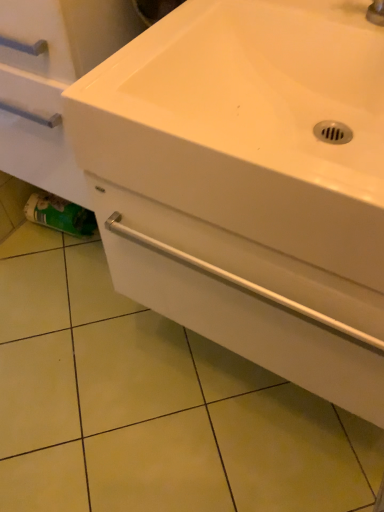
The height and width of the screenshot is (512, 384). Find the location of `white glossy drawer at center`. white glossy drawer at center is located at coordinates (247, 298).

Identify the location of white glossy sink at center. This screenshot has height=512, width=384. (249, 125).

From the picture: Is white glossy sink at center oriented away from white glossy drawer at center?

white glossy sink at center is not turned away from white glossy drawer at center.

From a real-world perspective, is white glossy sink at center on top of white glossy drawer at center?

Yes, from a real-world perspective, white glossy sink at center is above white glossy drawer at center.

Can you confirm if white glossy sink at center is bigger than white glossy drawer at center?

No.

Between point (130, 165) and point (341, 367), which one is positioned behind?

The point (341, 367) is behind.

Measure the distance from green matte toilet paper at lower left to white glossy drawer at center.

91.93 centimeters.

Is point (27, 202) behind point (132, 196)?

Yes, point (27, 202) is behind point (132, 196).

Which is correct: green matte toilet paper at lower left is inside white glossy drawer at center, or outside of it?

green matte toilet paper at lower left is spatially situated outside white glossy drawer at center.

Does point (218, 202) come in front of point (47, 206)?

Yes, it is in front of point (47, 206).

Could you tell me if white glossy sink at center is facing green matte toilet paper at lower left?

No, white glossy sink at center is not turned towards green matte toilet paper at lower left.

From a real-world perspective, is white glossy sink at center physically below green matte toilet paper at lower left?

No.

Does white glossy sink at center have a greater width compared to green matte toilet paper at lower left?

Indeed, white glossy sink at center has a greater width compared to green matte toilet paper at lower left.

Considering the positions of objects white glossy drawer at center and green matte toilet paper at lower left in the image provided, who is more to the right, white glossy drawer at center or green matte toilet paper at lower left?

From the viewer's perspective, white glossy drawer at center appears more on the right side.

Would you say white glossy drawer at center contains green matte toilet paper at lower left?

No, green matte toilet paper at lower left is not surrounded by white glossy drawer at center.

Can you confirm if white glossy drawer at center is thinner than green matte toilet paper at lower left?

Incorrect, the width of white glossy drawer at center is not less than that of green matte toilet paper at lower left.

Considering the sizes of objects white glossy drawer at center and green matte toilet paper at lower left in the image provided, who is smaller, white glossy drawer at center or green matte toilet paper at lower left?

green matte toilet paper at lower left is smaller.

Which of these two, white glossy drawer at center or white glossy sink at center, stands taller?

white glossy drawer at center.

Measure the distance from white glossy drawer at center to white glossy sink at center.

white glossy drawer at center and white glossy sink at center are 18.31 centimeters apart from each other.

Considering the positions of objects white glossy drawer at center and white glossy sink at center in the image provided, who is more to the left, white glossy drawer at center or white glossy sink at center?

From the viewer's perspective, white glossy sink at center appears more on the left side.

Locate an element on the screen. sink above the white glossy drawer at center (from the image's perspective) is located at coordinates (249, 125).

Is green matte toilet paper at lower left not inside white glossy sink at center?

green matte toilet paper at lower left lies outside white glossy sink at center's area.

Considering the relative sizes of green matte toilet paper at lower left and white glossy sink at center in the image provided, is green matte toilet paper at lower left thinner than white glossy sink at center?

Indeed, green matte toilet paper at lower left has a lesser width compared to white glossy sink at center.

Is green matte toilet paper at lower left turned away from white glossy sink at center?

green matte toilet paper at lower left does not have its back to white glossy sink at center.

Does green matte toilet paper at lower left touch white glossy sink at center?

No.

Identify the location of sink in front of the white glossy drawer at center. (249, 125).

You are a GUI agent. You are given a task and a screenshot of the screen. Output one action in this format:
    pyautogui.click(x=<x>, y=<y>)
    Task: Click on the toilet paper behind the white glossy drawer at center
    The height and width of the screenshot is (512, 384).
    Given the screenshot: What is the action you would take?
    pyautogui.click(x=60, y=214)

Which object lies further to the anchor point white glossy drawer at center, white glossy sink at center or green matte toilet paper at lower left?

Among the two, green matte toilet paper at lower left is located further to white glossy drawer at center.

From the image, which object appears to be nearer to white glossy sink at center, white glossy drawer at center or green matte toilet paper at lower left?

Among the two, white glossy drawer at center is located nearer to white glossy sink at center.

When comparing their distances from white glossy sink at center, does green matte toilet paper at lower left or white glossy drawer at center seem closer?

Among the two, white glossy drawer at center is located nearer to white glossy sink at center.

Based on their spatial positions, is green matte toilet paper at lower left or white glossy sink at center closer to white glossy drawer at center?

Among the two, white glossy sink at center is located nearer to white glossy drawer at center.

When comparing their distances from green matte toilet paper at lower left, does white glossy sink at center or white glossy drawer at center seem closer?

white glossy drawer at center is closer to green matte toilet paper at lower left.

When comparing their distances from green matte toilet paper at lower left, does white glossy drawer at center or white glossy sink at center seem closer?

The object closer to green matte toilet paper at lower left is white glossy drawer at center.

Where is `drawer between white glossy sink at center and green matte toilet paper at lower left along the z-axis`? The width and height of the screenshot is (384, 512). drawer between white glossy sink at center and green matte toilet paper at lower left along the z-axis is located at coordinates (247, 298).